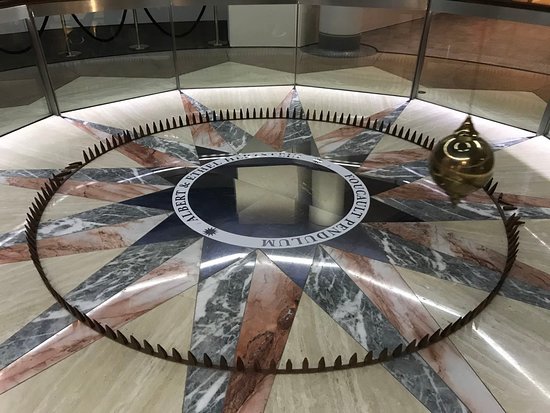
I want to click on rope dividers, so click(x=113, y=34), click(x=182, y=34), click(x=43, y=27).